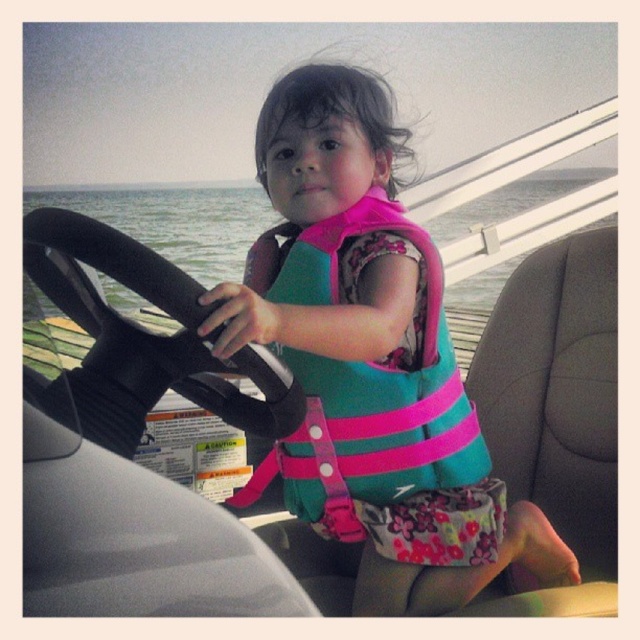
Question: Is teal fabric life vest at center to the right of teal/pink fabric life jacket at center from the viewer's perspective?

Choices:
 (A) yes
 (B) no

Answer: (A)

Question: Which of the following is the closest to the observer?

Choices:
 (A) (310, 480)
 (B) (404, 522)

Answer: (B)

Question: Among these objects, which one is farthest from the camera?

Choices:
 (A) teal fabric life vest at center
 (B) teal/pink fabric life jacket at center

Answer: (B)

Question: Does teal fabric life vest at center appear over teal/pink fabric life jacket at center?

Choices:
 (A) no
 (B) yes

Answer: (B)

Question: Does teal fabric life vest at center have a lesser width compared to teal/pink fabric life jacket at center?

Choices:
 (A) no
 (B) yes

Answer: (A)

Question: Which point appears closest to the camera in this image?

Choices:
 (A) (326, 403)
 (B) (381, 512)

Answer: (A)